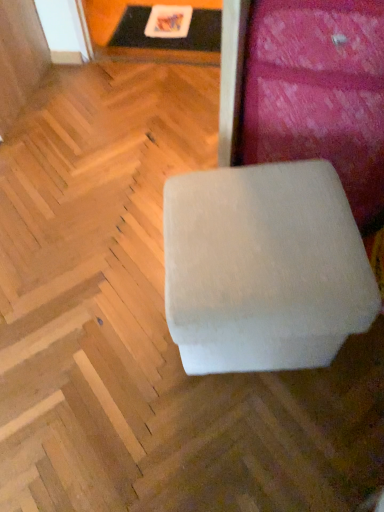
Locate an element on the screen. The height and width of the screenshot is (512, 384). free space in front of white fabric ottoman at center, which appears as the 1th furniture when ordered from the bottom is located at coordinates (252, 447).